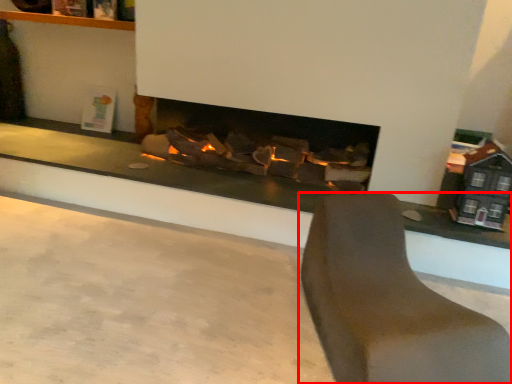
Question: From the image's perspective, where is furniture (annotated by the red box) located relative to concrete?

Choices:
 (A) above
 (B) below

Answer: (A)